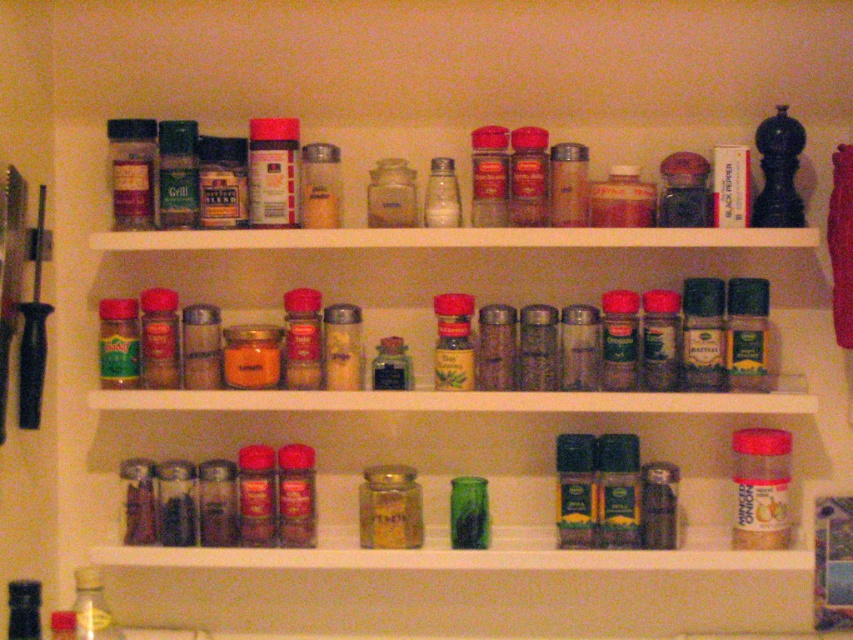
Is translucent glass jar at center smaller than green glass jar at lower center?

Correct, translucent glass jar at center occupies less space than green glass jar at lower center.

Is translucent glass jar at center taller than green glass jar at lower center?

Yes.

Locate an element on the screen. translucent glass jar at center is located at coordinates coord(389,508).